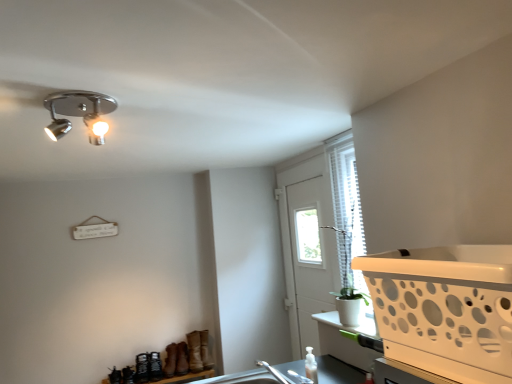
Question: Is chrome/metallic spotlight at upper left facing away from white plastic basket at right?

Choices:
 (A) no
 (B) yes

Answer: (A)

Question: Is chrome/metallic spotlight at upper left thinner than white plastic basket at right?

Choices:
 (A) no
 (B) yes

Answer: (B)

Question: Can you confirm if chrome/metallic spotlight at upper left is taller than white plastic basket at right?

Choices:
 (A) yes
 (B) no

Answer: (B)

Question: From a real-world perspective, is chrome/metallic spotlight at upper left over white plastic basket at right?

Choices:
 (A) no
 (B) yes

Answer: (B)

Question: Is chrome/metallic spotlight at upper left far away from white plastic basket at right?

Choices:
 (A) yes
 (B) no

Answer: (A)

Question: Does chrome/metallic spotlight at upper left appear on the right side of white plastic basket at right?

Choices:
 (A) yes
 (B) no

Answer: (B)

Question: Does white plastic screen door at center turn towards chrome/metallic spotlight at upper left?

Choices:
 (A) yes
 (B) no

Answer: (B)

Question: Is the position of white plastic screen door at center less distant than that of chrome/metallic spotlight at upper left?

Choices:
 (A) yes
 (B) no

Answer: (B)

Question: Is white plastic screen door at center further to the viewer compared to chrome/metallic spotlight at upper left?

Choices:
 (A) yes
 (B) no

Answer: (A)

Question: From the image's perspective, is white plastic screen door at center above chrome/metallic spotlight at upper left?

Choices:
 (A) no
 (B) yes

Answer: (A)

Question: Does white plastic screen door at center have a smaller size compared to chrome/metallic spotlight at upper left?

Choices:
 (A) no
 (B) yes

Answer: (A)

Question: Does white plastic screen door at center appear on the right side of chrome/metallic spotlight at upper left?

Choices:
 (A) yes
 (B) no

Answer: (A)

Question: Is translucent plastic bottle at lower center bigger than white plastic basket at right?

Choices:
 (A) no
 (B) yes

Answer: (A)